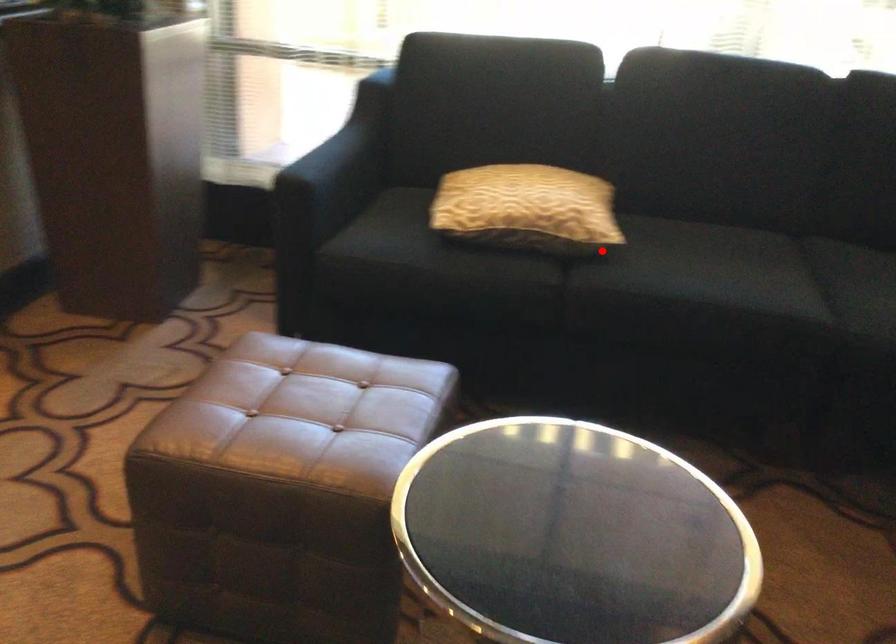
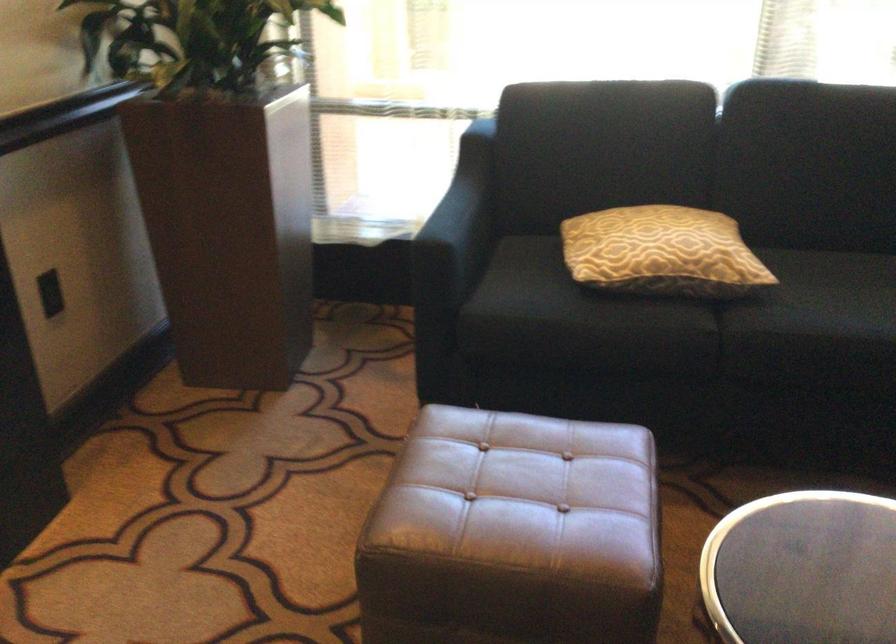
Locate, in the second image, the point that corresponds to the highlighted location in the first image.

(752, 289)